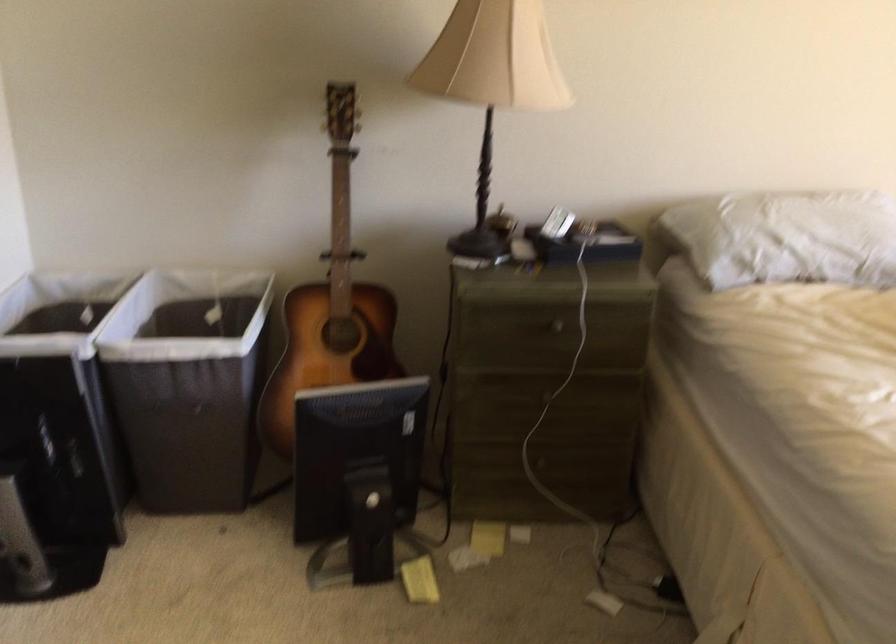
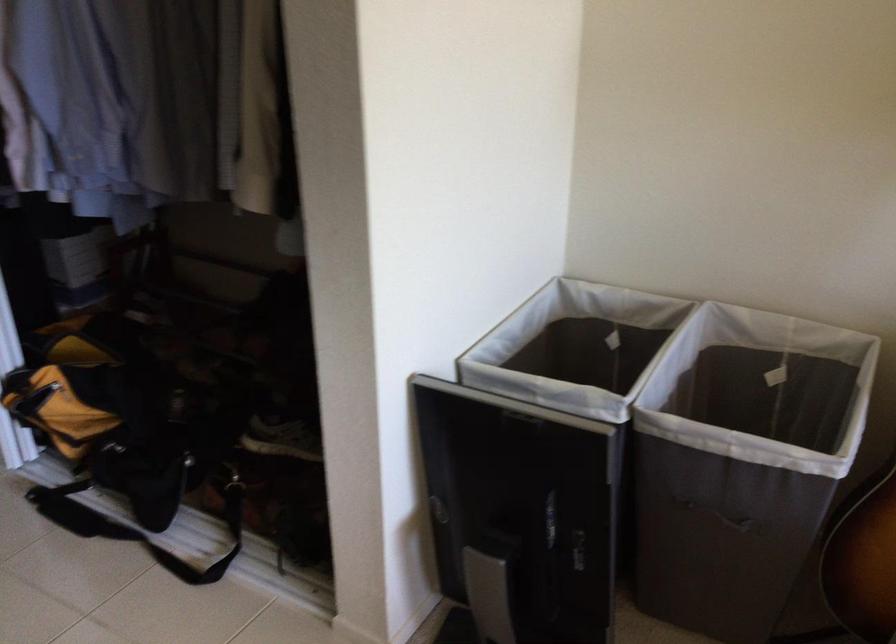
Where in the second image is the point corresponding to point 186,411 from the first image?

(719, 516)